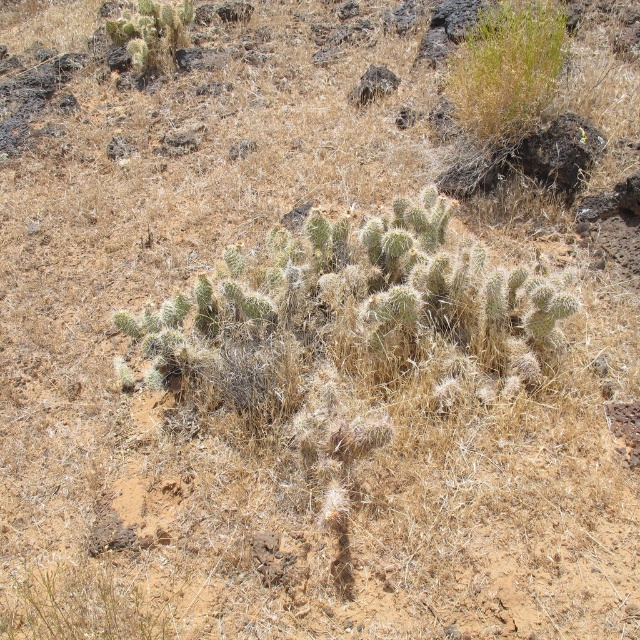
Consider the image. Between green fuzzy bush at upper center and green spiny cactus at upper left, which one has less height?

green spiny cactus at upper left

Is green fuzzy bush at upper center wider than green spiny cactus at upper left?

Incorrect, green fuzzy bush at upper center's width does not surpass green spiny cactus at upper left's.

The width and height of the screenshot is (640, 640). Identify the location of green fuzzy bush at upper center. (506, 72).